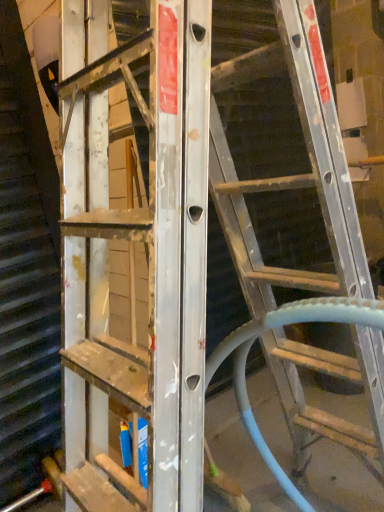
Describe the element at coordinates (277, 327) in the screenshot. I see `translucent rubber hose at center` at that location.

What are the coordinates of `translucent rubber hose at center` in the screenshot? It's located at (277, 327).

I want to click on translucent rubber hose at center, so click(277, 327).